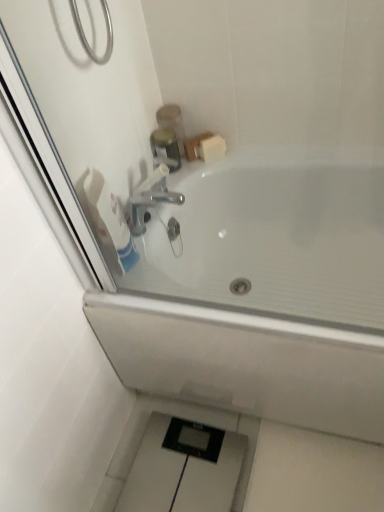
Measure the distance between white glossy bathtub at upper center and camera.

white glossy bathtub at upper center is 84.10 centimeters from camera.

I want to click on white matte soap at upper right, so click(x=211, y=148).

I want to click on white matte toilet paper at upper left, so [109, 219].

Identify the location of white glossy bathtub at upper center. This screenshot has height=512, width=384. (261, 292).

Which of these two, white glossy bathtub at upper center or white matte soap at upper right, is thinner?

Thinner between the two is white matte soap at upper right.

Identify the location of bathtub located on the right of white matte soap at upper right. This screenshot has width=384, height=512. (261, 292).

Is white glossy bathtub at upper center smaller than white matte soap at upper right?

No.

From the picture: From the image's perspective, which is below, white glossy bathtub at upper center or white matte soap at upper right?

From the image's view, white glossy bathtub at upper center is below.

Can you tell me how much white matte soap at upper right and white glossy bathtub at upper center differ in facing direction?

39.8 degrees.

Where is `bathtub in front of the white matte soap at upper right`? Image resolution: width=384 pixels, height=512 pixels. bathtub in front of the white matte soap at upper right is located at coordinates (261, 292).

From their relative heights in the image, would you say white matte soap at upper right is taller or shorter than white glossy bathtub at upper center?

Clearly, white matte soap at upper right is shorter compared to white glossy bathtub at upper center.

Could white glossy bathtub at upper center be considered to be inside white matte soap at upper right?

No, white matte soap at upper right does not contain white glossy bathtub at upper center.

Visually, is brushed metal soap dispenser at upper center positioned to the left or to the right of white glossy bathtub at upper center?

brushed metal soap dispenser at upper center is positioned on white glossy bathtub at upper center's left side.

Could you measure the distance between brushed metal soap dispenser at upper center and white glossy bathtub at upper center?

The distance of brushed metal soap dispenser at upper center from white glossy bathtub at upper center is 20.61 inches.

Can you confirm if brushed metal soap dispenser at upper center is bigger than white glossy bathtub at upper center?

No.

Is brushed metal soap dispenser at upper center inside or outside of white glossy bathtub at upper center?

brushed metal soap dispenser at upper center is not inside white glossy bathtub at upper center, it's outside.

Who is bigger, white matte toilet paper at upper left or white glossy bathtub at upper center?

With larger size is white glossy bathtub at upper center.

The image size is (384, 512). Identify the location of toilet paper above the white glossy bathtub at upper center (from a real-world perspective). (109, 219).

Which is more to the left, white matte toilet paper at upper left or white glossy bathtub at upper center?

white matte toilet paper at upper left.

Considering the relative sizes of white matte toilet paper at upper left and white glossy bathtub at upper center in the image provided, is white matte toilet paper at upper left thinner than white glossy bathtub at upper center?

Yes.

At what (x,y) coordinates should I click in order to perform the action: click on soap below the brushed metal soap dispenser at upper center (from the image's perspective). Please return your answer as a coordinate pair (x, y). Image resolution: width=384 pixels, height=512 pixels. Looking at the image, I should click on (211, 148).

Which of these two, white matte soap at upper right or brushed metal soap dispenser at upper center, stands shorter?

Standing shorter between the two is white matte soap at upper right.

Looking at this image, considering the relative positions of white matte soap at upper right and brushed metal soap dispenser at upper center in the image provided, is white matte soap at upper right behind brushed metal soap dispenser at upper center?

Yes, it is behind brushed metal soap dispenser at upper center.

Considering the positions of objects white matte soap at upper right and brushed metal faucet at upper center in the image provided, who is more to the left, white matte soap at upper right or brushed metal faucet at upper center?

Positioned to the left is brushed metal faucet at upper center.

Do you think white matte soap at upper right is within brushed metal faucet at upper center, or outside of it?

white matte soap at upper right is not enclosed by brushed metal faucet at upper center.

From the image's perspective, is white matte soap at upper right located above or below brushed metal faucet at upper center?

Based on their image positions, white matte soap at upper right is located above brushed metal faucet at upper center.

What's the angular difference between white matte soap at upper right and brushed metal faucet at upper center's facing directions?

They differ by 50 degrees in their facing directions.

Who is taller, brushed metal soap dispenser at upper center or white matte toilet paper at upper left?

white matte toilet paper at upper left.

From the image's perspective, between brushed metal soap dispenser at upper center and white matte toilet paper at upper left, which one is located above?

brushed metal soap dispenser at upper center is shown above in the image.

Which of these two, brushed metal soap dispenser at upper center or white matte toilet paper at upper left, is wider?

brushed metal soap dispenser at upper center is wider.

Identify the location of soap behind the white glossy bathtub at upper center. This screenshot has width=384, height=512. (211, 148).

Identify the location of soap to the left of white glossy bathtub at upper center. This screenshot has width=384, height=512. (211, 148).

From the image, which object appears to be nearer to white glossy bathtub at upper center, white matte toilet paper at upper left or white matte soap at upper right?

white matte toilet paper at upper left is closer to white glossy bathtub at upper center.

In the scene shown: Estimate the real-world distances between objects in this image. Which object is closer to brushed metal faucet at upper center, white matte toilet paper at upper left or white glossy bathtub at upper center?

white matte toilet paper at upper left lies closer to brushed metal faucet at upper center than the other object.

When comparing their distances from white matte toilet paper at upper left, does brushed metal faucet at upper center or white glossy bathtub at upper center seem closer?

Among the two, brushed metal faucet at upper center is located nearer to white matte toilet paper at upper left.

Looking at the image, which one is located closer to white matte toilet paper at upper left, white matte soap at upper right or brushed metal soap dispenser at upper center?

brushed metal soap dispenser at upper center.

Which object lies nearer to the anchor point brushed metal faucet at upper center, white matte soap at upper right or white matte toilet paper at upper left?

The object closer to brushed metal faucet at upper center is white matte soap at upper right.

Which object lies nearer to the anchor point white matte soap at upper right, brushed metal faucet at upper center or white glossy bathtub at upper center?

The object closer to white matte soap at upper right is brushed metal faucet at upper center.

Which object lies nearer to the anchor point brushed metal faucet at upper center, brushed metal soap dispenser at upper center or white matte soap at upper right?

brushed metal soap dispenser at upper center lies closer to brushed metal faucet at upper center than the other object.

Considering their positions, is white matte soap at upper right positioned further to white glossy bathtub at upper center than white matte toilet paper at upper left?

The object further to white glossy bathtub at upper center is white matte soap at upper right.

Identify the location of plumbing fixture between white glossy bathtub at upper center and white matte soap at upper right from front to back. (165, 148).

Locate an element on the screen. This screenshot has height=512, width=384. toiletry between white matte toilet paper at upper left and white matte soap at upper right from front to back is located at coordinates (172, 123).

Where is `toilet paper between white glossy bathtub at upper center and brushed metal soap dispenser at upper center in the front-back direction`? The image size is (384, 512). toilet paper between white glossy bathtub at upper center and brushed metal soap dispenser at upper center in the front-back direction is located at coordinates (x=109, y=219).

At what (x,y) coordinates should I click in order to perform the action: click on toiletry between brushed metal faucet at upper center and white matte soap at upper right. Please return your answer as a coordinate pair (x, y). This screenshot has width=384, height=512. Looking at the image, I should click on (172, 123).